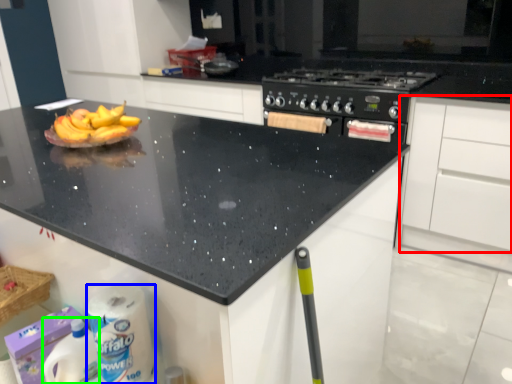
Question: Which is farther away from cabinetry (highlighted by a red box)? toilet paper (highlighted by a blue box) or cleaning product (highlighted by a green box)?

Choices:
 (A) toilet paper
 (B) cleaning product

Answer: (B)